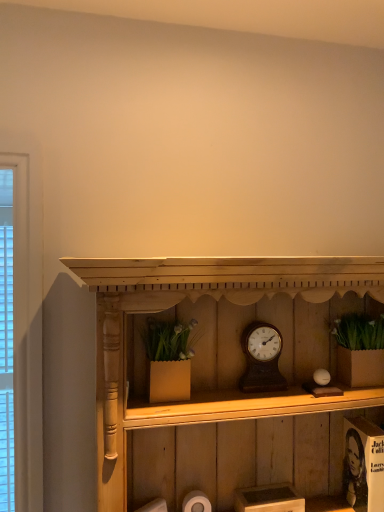
Measure the distance between wooden shelf at center and camera.

The distance of wooden shelf at center from camera is 31.95 inches.

Describe the element at coordinates (223, 374) in the screenshot. I see `wooden shelf at center` at that location.

At what (x,y) coordinates should I click in order to perform the action: click on wooden shelf at center. Please return your answer as a coordinate pair (x, y). Image resolution: width=384 pixels, height=512 pixels. Looking at the image, I should click on (223, 374).

This screenshot has width=384, height=512. Identify the location of alarm clock located behind the wooden shelf at center. (262, 358).

From a real-world perspective, which is physically below, wooden clock at center or wooden shelf at center?

In real-world perspective, wooden shelf at center is lower.

Is wooden clock at center thinner than wooden shelf at center?

Yes, wooden clock at center is thinner than wooden shelf at center.

Considering the positions of objects wooden clock at center and wooden shelf at center in the image provided, who is more to the left, wooden clock at center or wooden shelf at center?

wooden shelf at center is more to the left.

Does point (200, 490) come farther from viewer compared to point (265, 384)?

Yes, it is behind point (265, 384).

Measure the distance between white matte toilet paper at lower center and wooden clock at center.

15.01 inches.

Is white matte toilet paper at lower center at the right side of wooden clock at center?

In fact, white matte toilet paper at lower center is to the left of wooden clock at center.

Locate an element on the screen. This screenshot has height=512, width=384. toilet paper in front of the wooden clock at center is located at coordinates (196, 502).

Based on their positions, is wooden shelf at center located to the left or right of white matte toilet paper at lower center?

wooden shelf at center is to the right of white matte toilet paper at lower center.

Is white matte toilet paper at lower center inside wooden shelf at center?

Yes.

From the picture: From the image's perspective, between wooden shelf at center and white matte toilet paper at lower center, who is located below?

From the image's view, white matte toilet paper at lower center is below.

In the scene shown: What's the angular difference between wooden shelf at center and white matte toilet paper at lower center's facing directions?

The angular difference between wooden shelf at center and white matte toilet paper at lower center is 2.98 degrees.

Would you say white matte toilet paper at lower center contains wooden shelf at center?

No, white matte toilet paper at lower center does not contain wooden shelf at center.

Does white matte toilet paper at lower center have a lesser width compared to wooden shelf at center?

Yes, white matte toilet paper at lower center is thinner than wooden shelf at center.

Which is less distant, (198, 506) or (360, 399)?

The point (360, 399) is in front.

Can you confirm if white matte toilet paper at lower center is positioned to the left of wooden shelf at center?

Yes, white matte toilet paper at lower center is to the left of wooden shelf at center.

How far apart are wooden clock at center and white matte toilet paper at lower center?

A distance of 15.01 inches exists between wooden clock at center and white matte toilet paper at lower center.

Based on the photo, how different are the orientations of wooden clock at center and white matte toilet paper at lower center in degrees?

4.44 degrees separate the facing orientations of wooden clock at center and white matte toilet paper at lower center.

Between wooden clock at center and white matte toilet paper at lower center, which one has larger size?

wooden clock at center is bigger.

From the picture: From the image's perspective, is wooden clock at center beneath white matte toilet paper at lower center?

Actually, wooden clock at center appears above white matte toilet paper at lower center in the image.

Between point (245, 293) and point (276, 377), which one is positioned in front?

The point (245, 293) is more forward.

Find the location of a particular element. This screenshot has width=384, height=512. shelf in front of the wooden clock at center is located at coordinates click(223, 374).

Is wooden shelf at center positioned far away from wooden clock at center?

No, wooden shelf at center is not far away from wooden clock at center.

Based on the photo, can you tell me how much wooden shelf at center and wooden clock at center differ in facing direction?

wooden shelf at center and wooden clock at center are facing 1.47 degrees away from each other.

At what (x,y) coordinates should I click in order to perform the action: click on shelf below the wooden clock at center (from a real-world perspective). Please return your answer as a coordinate pair (x, y). Image resolution: width=384 pixels, height=512 pixels. Looking at the image, I should click on (223, 374).

Identify the location of toilet paper located in front of the wooden clock at center. (196, 502).

From the image, which object appears to be farther from wooden shelf at center, wooden clock at center or white matte toilet paper at lower center?

white matte toilet paper at lower center is positioned further to the anchor wooden shelf at center.

From the image, which object appears to be nearer to wooden shelf at center, white matte toilet paper at lower center or wooden clock at center?

Among the two, wooden clock at center is located nearer to wooden shelf at center.

When comparing their distances from white matte toilet paper at lower center, does wooden clock at center or wooden shelf at center seem closer?

wooden clock at center.

Looking at this image, looking at the image, which one is located closer to wooden clock at center, wooden shelf at center or white matte toilet paper at lower center?

wooden shelf at center.

Looking at the image, which one is located further to white matte toilet paper at lower center, wooden shelf at center or wooden clock at center?

wooden shelf at center lies further to white matte toilet paper at lower center than the other object.

Which object lies nearer to the anchor point wooden clock at center, white matte toilet paper at lower center or wooden shelf at center?

wooden shelf at center is closer to wooden clock at center.

Locate an element on the screen. toilet paper located between wooden shelf at center and wooden clock at center in the depth direction is located at coordinates (196, 502).